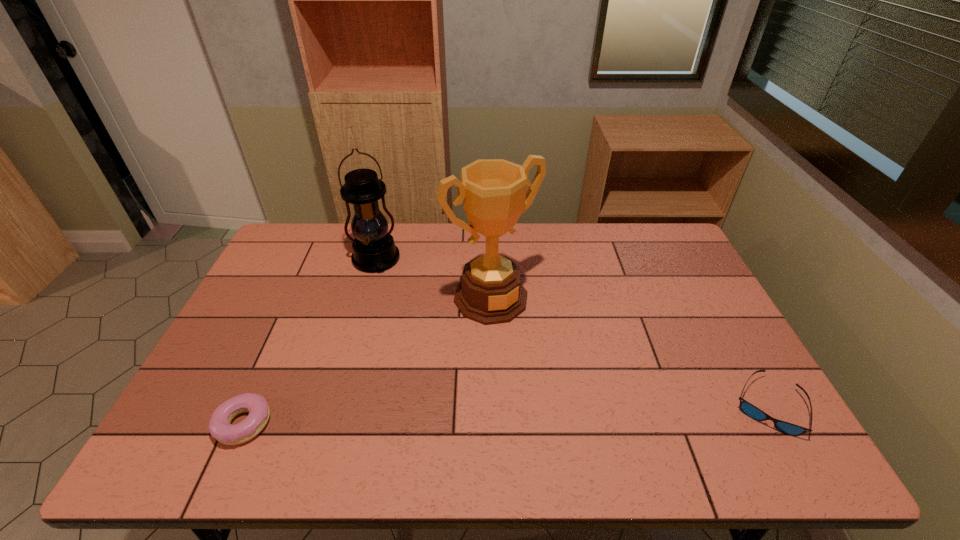
Where is `the leftmost object`? the leftmost object is located at coordinates (220, 427).

At what (x,y) coordinates should I click in order to perform the action: click on sunglasses. Please return your answer as a coordinate pair (x, y). Looking at the image, I should click on (747, 408).

Find the location of a particular element. The height and width of the screenshot is (540, 960). lantern is located at coordinates (374, 250).

Where is `the third shortest object`? The height and width of the screenshot is (540, 960). the third shortest object is located at coordinates (374, 250).

I want to click on award, so click(493, 191).

I want to click on vacant space located 0.400m on the right of the doughnut, so click(x=441, y=424).

Choose a point located above the third object from right to left, indicating its light source in the vacant region. Please provide its 2D coordinates. Your answer should be formatted as a tuple, i.e. [(x, y)], where the tuple contains the x and y coordinates of a point satisfying the conditions above.

[(406, 341)]

Locate several points within the vacant space situated 0.150m above the third object from right to left, indicating its light source. Please provide its 2D coordinates. Your answer should be formatted as a tuple, i.e. [(x, y)], where the tuple contains the x and y coordinates of a point satisfying the conditions above.

[(392, 304)]

Locate several points within the vacant space situated above the third object from right to left, indicating its light source. Please provide its 2D coordinates. Your answer should be formatted as a tuple, i.e. [(x, y)], where the tuple contains the x and y coordinates of a point satisfying the conditions above.

[(397, 320)]

Where is `vacant space located on the front-facing side of the second object from right to left`? vacant space located on the front-facing side of the second object from right to left is located at coordinates (565, 389).